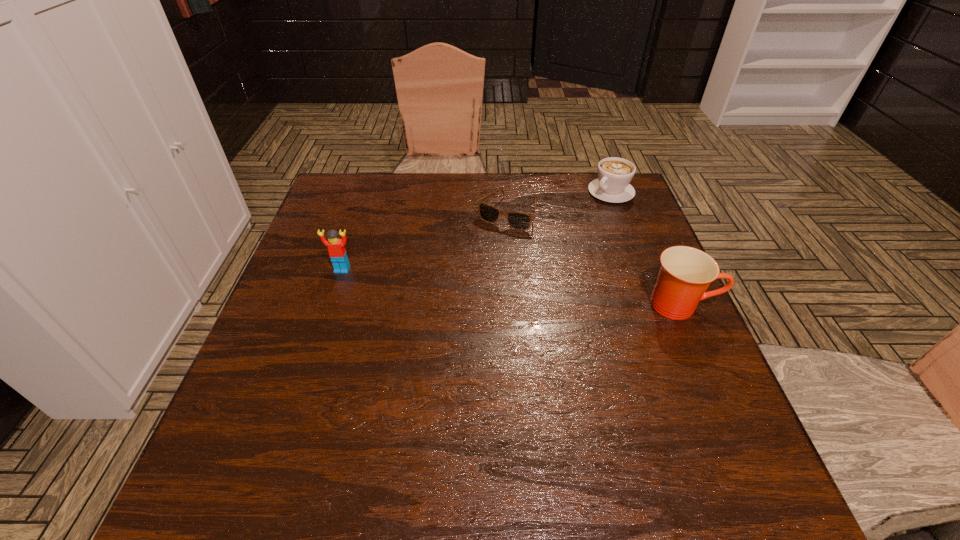
At what (x,y) coordinates should I click in order to perform the action: click on free region that satisfies the following two spatial constraints: 1. on the front side of the nearest object; 2. on the left side of the cappuccino. Please return your answer as a coordinate pair (x, y). Looking at the image, I should click on (655, 305).